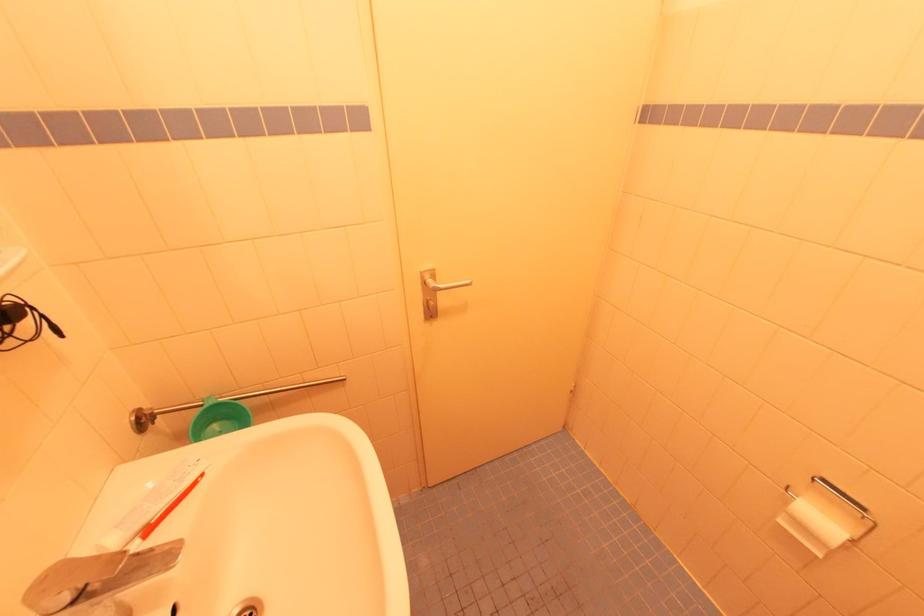
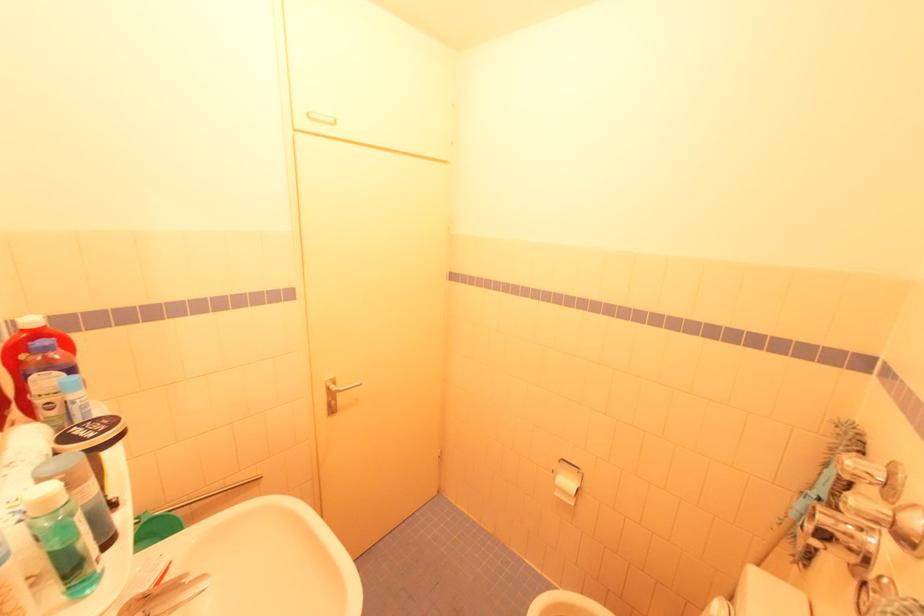
Question: The camera is either moving clockwise (left) or counter-clockwise (right) around the object. The first image is from the beginning of the video and the second image is from the end. Is the camera moving left or right when shooting the video?

Choices:
 (A) Left
 (B) Right

Answer: (A)